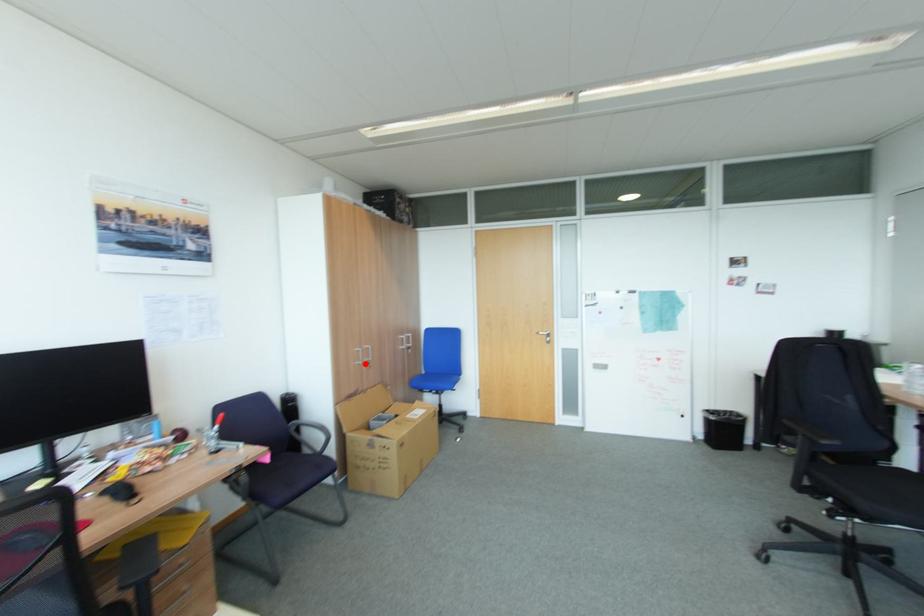
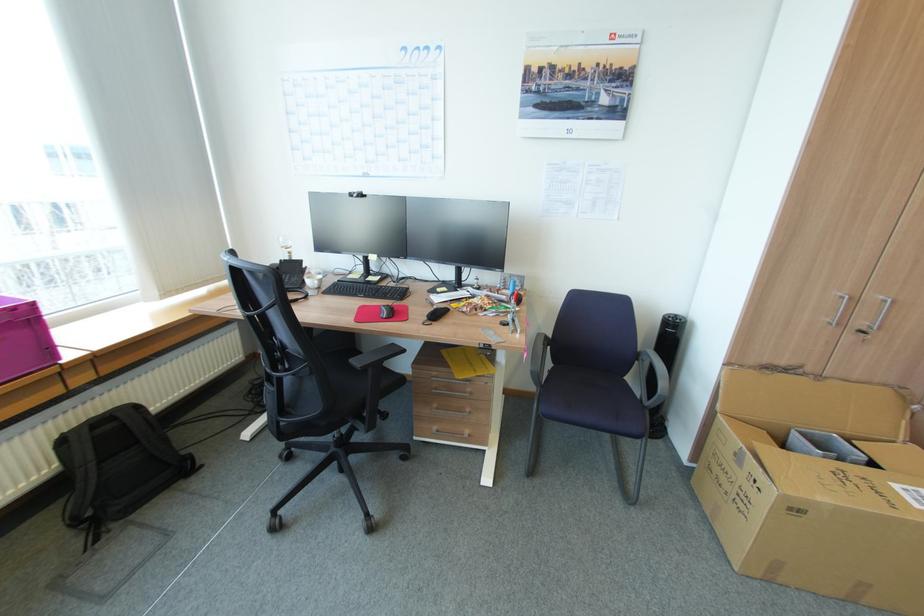
Locate, in the second image, the point that corresponds to the highlighted location in the first image.

(833, 323)